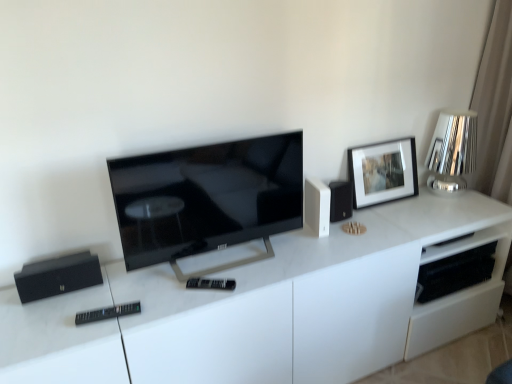
The width and height of the screenshot is (512, 384). In order to click on vacant area that lies to the right of black plastic remote at lower left, acting as the first remote starting from the left in this screenshot , I will do (159, 311).